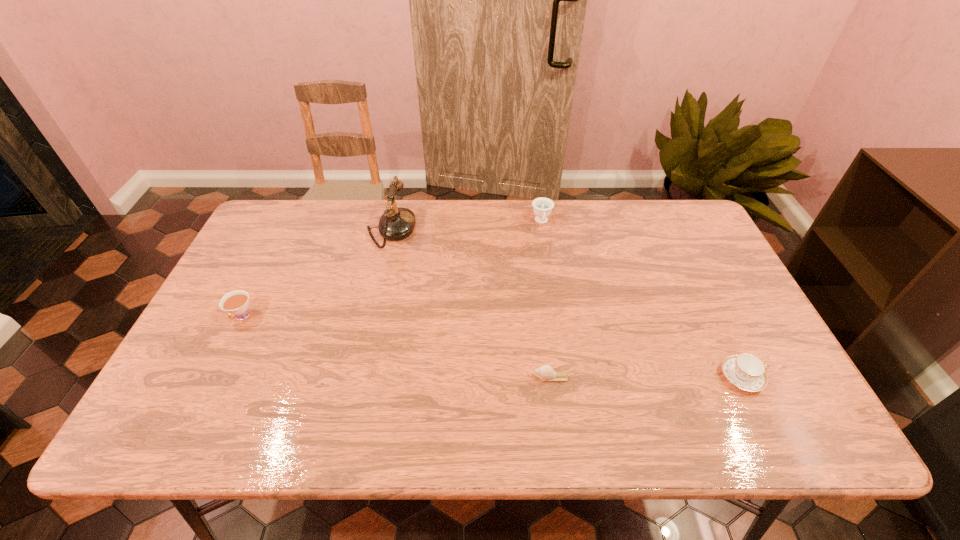
The width and height of the screenshot is (960, 540). I want to click on vacant space situated on the side of the leftmost teacup with the handle, so click(x=227, y=348).

This screenshot has width=960, height=540. I want to click on vacant space located on the shell of the shortest object, so click(x=367, y=377).

Identify the location of free space located 0.380m on the shell of the shortest object. (372, 377).

Where is `free space located 0.230m on the shell of the shortest object`? This screenshot has height=540, width=960. free space located 0.230m on the shell of the shortest object is located at coordinates (435, 377).

The image size is (960, 540). In order to click on telephone that is at the far edge in this screenshot , I will do `click(396, 223)`.

Find the location of a particular element. teacup located in the far edge section of the desktop is located at coordinates (542, 207).

Where is `object present at the left edge`? This screenshot has width=960, height=540. object present at the left edge is located at coordinates (236, 302).

In order to click on object that is at the right edge in this screenshot , I will do point(745,371).

Locate an element on the screen. vacant area at the far edge of the desktop is located at coordinates (366, 212).

At what (x,y) coordinates should I click in order to perform the action: click on vacant region at the near edge of the desktop. Please return your answer as a coordinate pair (x, y). This screenshot has width=960, height=540. Looking at the image, I should click on [x=411, y=440].